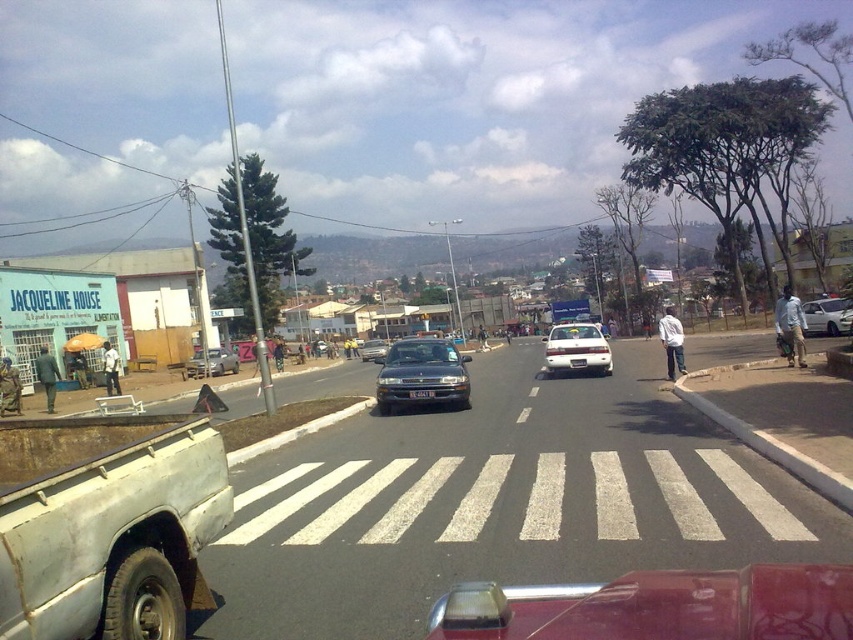
Question: Is white cotton shirt at center smaller than dark green uniform at left?

Choices:
 (A) no
 (B) yes

Answer: (A)

Question: Which object is farther from the camera taking this photo?

Choices:
 (A) camouflage fabric uniform at left
 (B) silver metallic sedan at center
 (C) white cotton shirt at center

Answer: (B)

Question: Which object is the closest to the white cotton shirt at center?

Choices:
 (A) camouflage fabric uniform at left
 (B) dark blue shirt at center
 (C) black plastic license plate at center
 (D) light blue shirt at right

Answer: (D)

Question: Which point is closer to the camera?

Choices:
 (A) (106, 340)
 (B) (680, 593)
 (C) (282, 358)

Answer: (B)

Question: Is satin black suv at center above black plastic license plate at center?

Choices:
 (A) yes
 (B) no

Answer: (B)

Question: Is metallic red pickup truck at lower center further to the viewer compared to black plastic license plate at center?

Choices:
 (A) yes
 (B) no

Answer: (B)